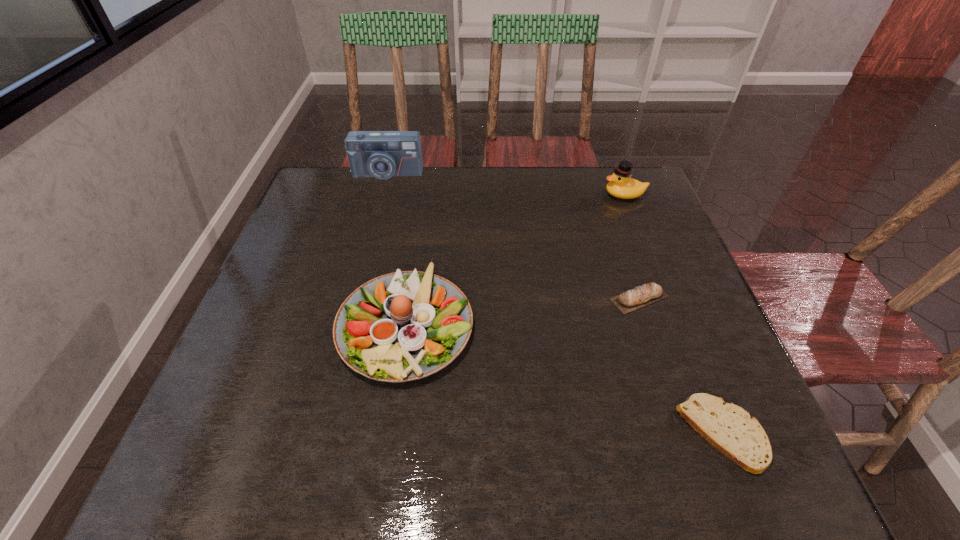
What are the coordinates of `free spot between the second farthest object and the shorter pita bread` in the screenshot? It's located at (673, 314).

Locate an element on the screen. The image size is (960, 540). free point between the duck and the shorter pita bread is located at coordinates (673, 314).

This screenshot has height=540, width=960. In order to click on free space that is in between the tallest object and the shorter pita bread in this screenshot , I will do `click(554, 303)`.

I want to click on vacant area that lies between the farther pita bread and the salad plate, so click(522, 311).

Image resolution: width=960 pixels, height=540 pixels. What are the coordinates of `unoccupied position between the duck and the tallest object` in the screenshot? It's located at (506, 184).

Find the location of a particular element. Image resolution: width=960 pixels, height=540 pixels. vacant space that's between the farthest object and the shorter pita bread is located at coordinates (554, 303).

Where is `free space between the shortest object and the fourth tallest object`? free space between the shortest object and the fourth tallest object is located at coordinates (681, 366).

Find the location of a particular element. vacant space that is in between the shorter pita bread and the salad plate is located at coordinates (564, 379).

Where is `vacant region between the farther pita bread and the duck`? Image resolution: width=960 pixels, height=540 pixels. vacant region between the farther pita bread and the duck is located at coordinates (632, 246).

Locate which object is the third closest to the salad plate. Please provide its 2D coordinates. Your answer should be formatted as a tuple, i.e. [(x, y)], where the tuple contains the x and y coordinates of a point satisfying the conditions above.

[(381, 154)]